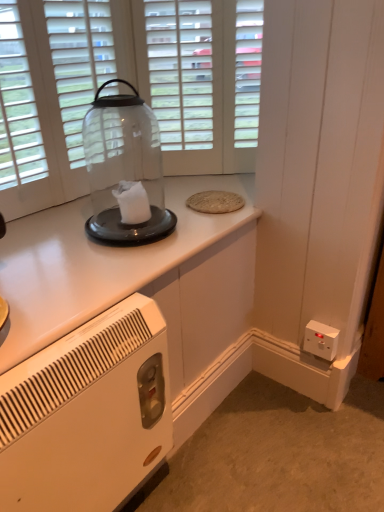
At what (x,y) coordinates should I click in order to perform the action: click on free location in front of transparent glass door at upper center. Please return your answer as a coordinate pair (x, y). The height and width of the screenshot is (512, 384). Looking at the image, I should click on (190, 187).